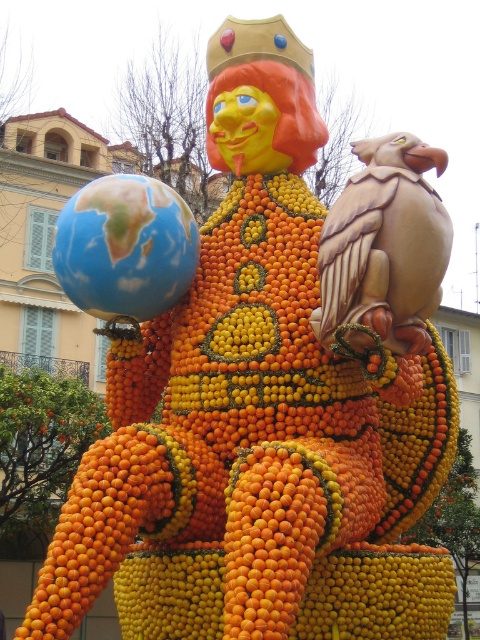
You are an artist planning to create a miniature version of the sculpture. You need to know the relative sizes of the orange textured globe at left and the orange matte at lower center to scale them down appropriately. Which object is bigger?

The orange textured globe at left is larger in size than orange matte at lower center.

You are an art conservator standing 100 feet away from the sculpture. You need to reach the orange textured globe at left to inspect it. Is the globe within your reach without moving closer?

The orange textured globe at left is 77.71 feet away from the camera. Since you are standing 100 feet away, the globe is farther than your current position, so you need to move closer to reach it.

You are an art curator planning to move the orange textured globe at left and the blue glossy globe at left closer together for a better visual balance. Given that the sculpture is in a room with a 7 meter wide space, will the two globes fit within the space when placed side by side?

The orange textured globe at left and blue glossy globe at left are 7.15 meters apart, so they cannot fit within the 7 meter wide space as their combined width exceeds the available room.